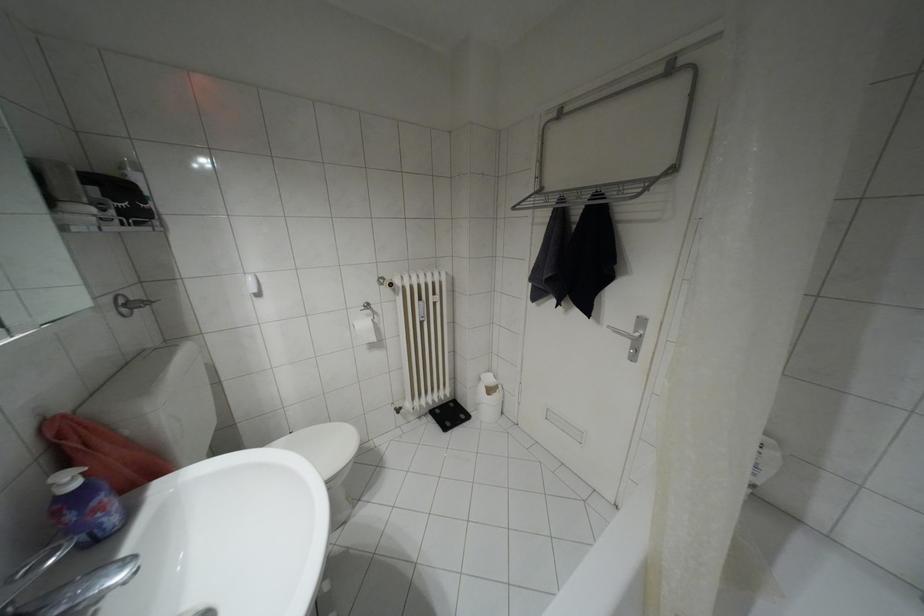
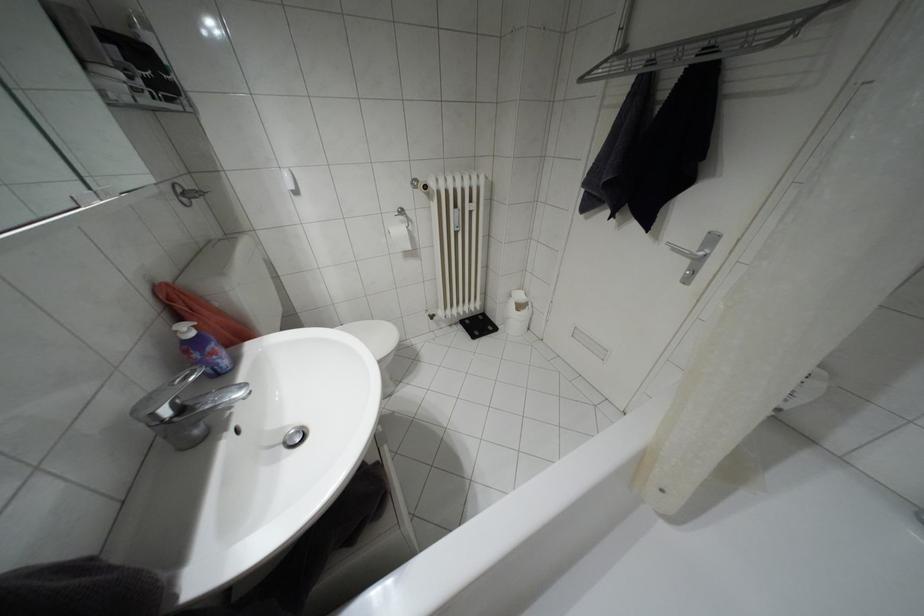
Question: I am providing you with two images of the same scene from different viewpoints. After the viewpoint changes to image2, which objects are now occluded?

Choices:
 (A) white trash can
 (B) sink faucet handle
 (C) black digital scale
 (D) none of these

Answer: (D)